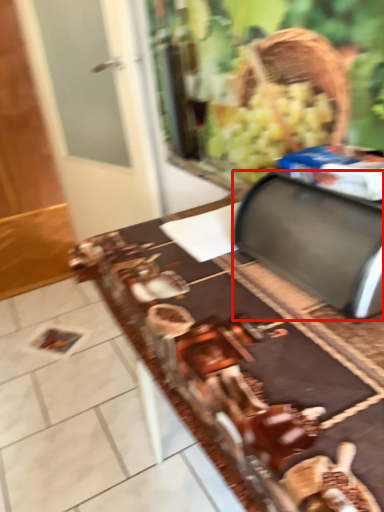
Question: From the image's perspective, what is the correct spatial positioning of wide (annotated by the red box) in reference to table?

Choices:
 (A) above
 (B) below

Answer: (A)